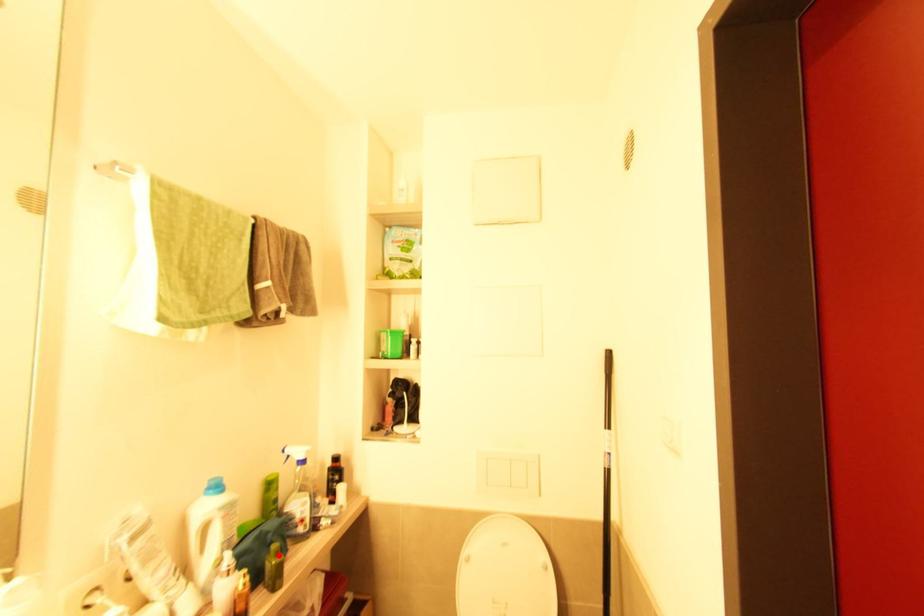
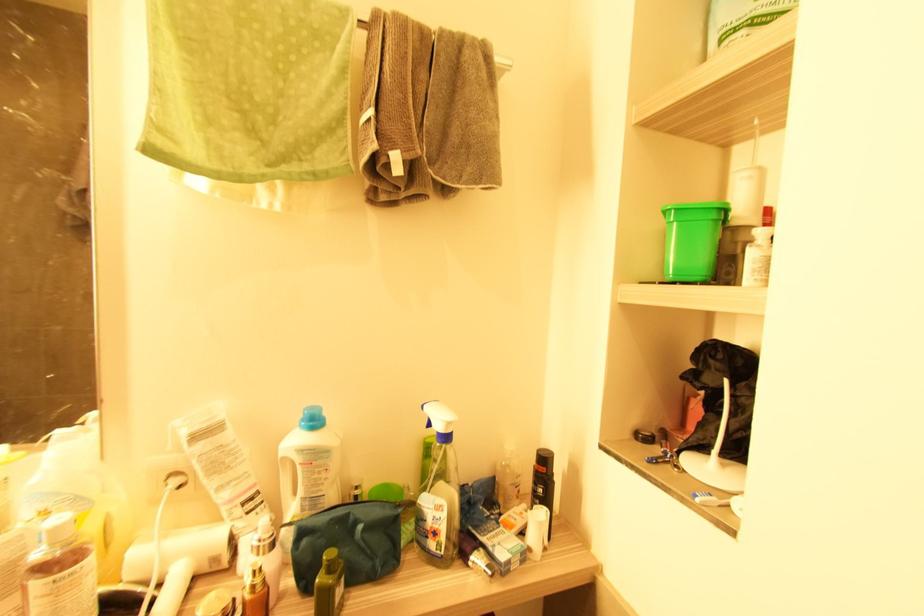
Where in the second image is the point corresponding to the highlighted location from the first image?

(331, 572)